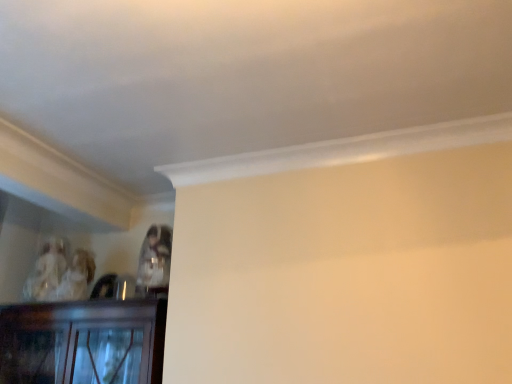
Question: Considering the positions of point (39, 266) and point (164, 261), is point (39, 266) closer or farther from the camera than point (164, 261)?

Choices:
 (A) farther
 (B) closer

Answer: (A)

Question: Is matte white porcelain figurine at upper left, positioned as the 2th person in front-to-back order, inside or outside of matte plastic cup at upper center, acting as the 1th person starting from the front?

Choices:
 (A) outside
 (B) inside

Answer: (A)

Question: From the image's perspective, is matte white porcelain figurine at upper left, positioned as the 2th person in front-to-back order, located above or below matte plastic cup at upper center, acting as the 1th person starting from the front?

Choices:
 (A) above
 (B) below

Answer: (B)

Question: Is matte plastic cup at upper center, the second person in the left-to-right sequence, wider or thinner than matte white porcelain figurine at upper left, the 1th person when ordered from back to front?

Choices:
 (A) wide
 (B) thin

Answer: (B)

Question: Considering the positions of matte plastic cup at upper center, the second person viewed from the back, and matte white porcelain figurine at upper left, the 1th person when ordered from back to front, in the image, is matte plastic cup at upper center, the second person viewed from the back, bigger or smaller than matte white porcelain figurine at upper left, the 1th person when ordered from back to front,?

Choices:
 (A) small
 (B) big

Answer: (A)

Question: Does point (169, 236) appear closer or farther from the camera than point (27, 294)?

Choices:
 (A) farther
 (B) closer

Answer: (B)

Question: Is matte plastic cup at upper center, which is the 1th person from right to left, taller or shorter than matte white porcelain figurine at upper left, the 1th person when ordered from back to front?

Choices:
 (A) short
 (B) tall

Answer: (A)